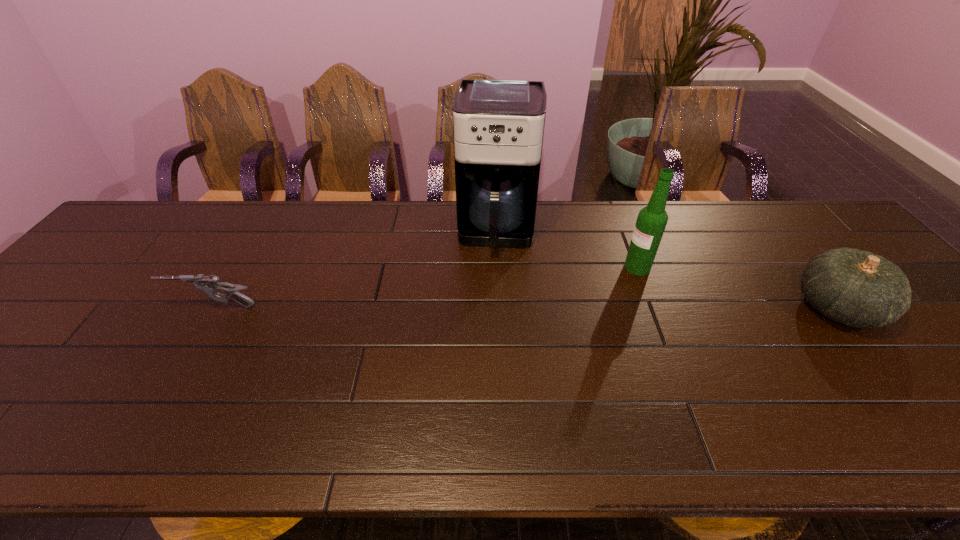
This screenshot has height=540, width=960. Identify the location of free space located 0.220m at the barrel of the shortest object. (84, 307).

The width and height of the screenshot is (960, 540). I want to click on free space located 0.060m on the left of the gourd, so click(x=772, y=308).

Where is `free point located on the front panel of the third object from right to left`? Image resolution: width=960 pixels, height=540 pixels. free point located on the front panel of the third object from right to left is located at coordinates point(489,341).

The height and width of the screenshot is (540, 960). I want to click on free space located on the front panel of the third object from right to left, so click(486, 380).

You are a GUI agent. You are given a task and a screenshot of the screen. Output one action in this format:
    pyautogui.click(x=<x>, y=<y>)
    Task: Click on the vacant space located on the front panel of the third object from right to left
    
    Given the screenshot: What is the action you would take?
    click(491, 315)

I want to click on vacant area situated on the label of the third shortest object, so click(x=546, y=327).

Identify the location of free space located on the label of the third shortest object. The height and width of the screenshot is (540, 960). (538, 333).

Identify the location of free region located on the label of the third shortest object. This screenshot has width=960, height=540. (585, 301).

You are a GUI agent. You are given a task and a screenshot of the screen. Output one action in this format:
    pyautogui.click(x=<x>, y=<y>)
    Task: Click on the object situated at the far edge
    This screenshot has height=540, width=960.
    Given the screenshot: What is the action you would take?
    pyautogui.click(x=498, y=124)

The image size is (960, 540). I want to click on object that is at the right edge, so click(857, 288).